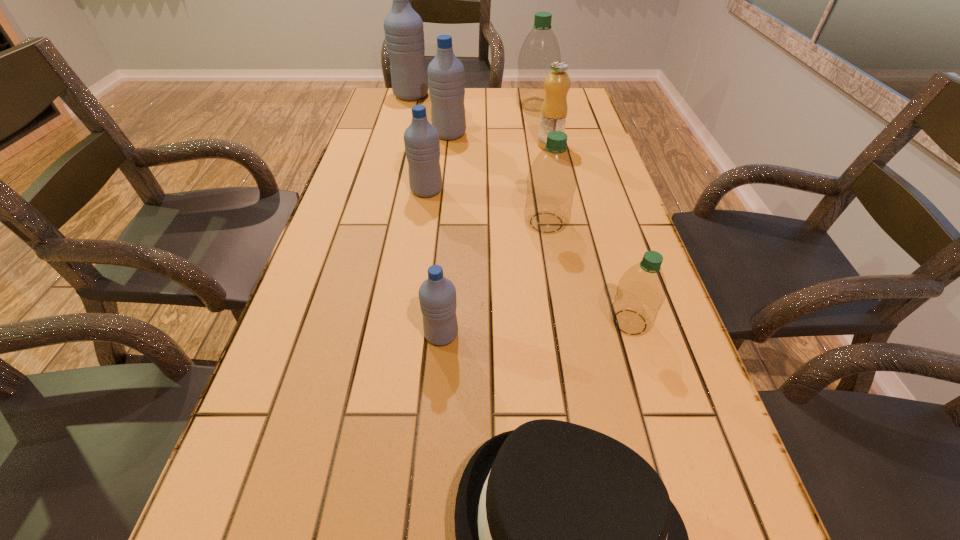
I want to click on the leftmost blue water bottle, so click(x=403, y=27).

Where is `the leftmost object`? This screenshot has height=540, width=960. the leftmost object is located at coordinates (403, 27).

Identify the location of the biggest green water bottle. Image resolution: width=960 pixels, height=540 pixels. (540, 49).

The width and height of the screenshot is (960, 540). Find the location of `the third smallest blue water bottle`. the third smallest blue water bottle is located at coordinates (446, 75).

The height and width of the screenshot is (540, 960). Identify the location of the third nearest blue water bottle. pos(446,75).

Where is `fruit juice`? fruit juice is located at coordinates (553, 116).

Locate an element on the screen. The height and width of the screenshot is (540, 960). the third biggest blue water bottle is located at coordinates (421, 139).

Where is `the fourth nearest water bottle`? This screenshot has height=540, width=960. the fourth nearest water bottle is located at coordinates (421, 139).

Where is `the fifth farthest water bottle`? The width and height of the screenshot is (960, 540). the fifth farthest water bottle is located at coordinates (551, 181).

Find the location of a particular element. The height and width of the screenshot is (540, 960). the sixth farthest object is located at coordinates (551, 181).